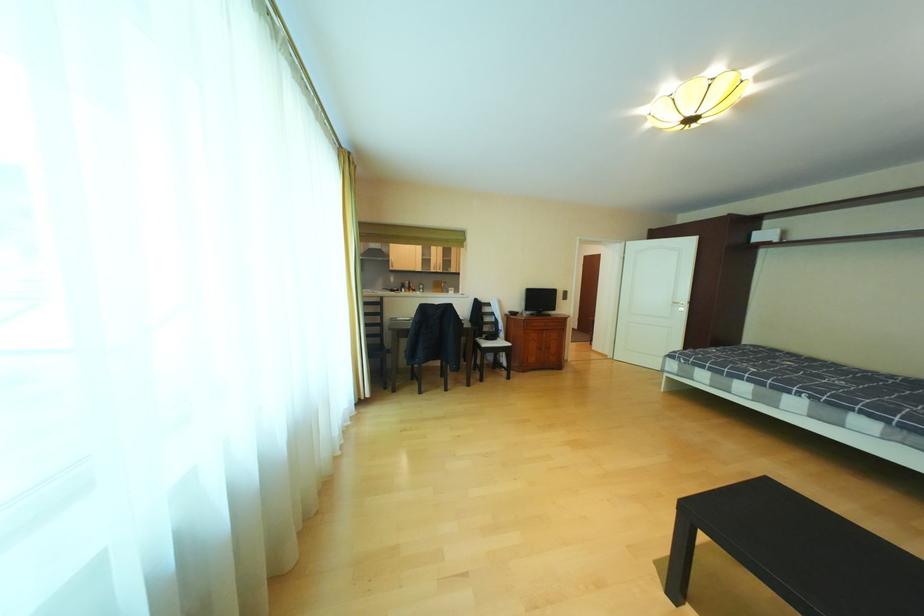
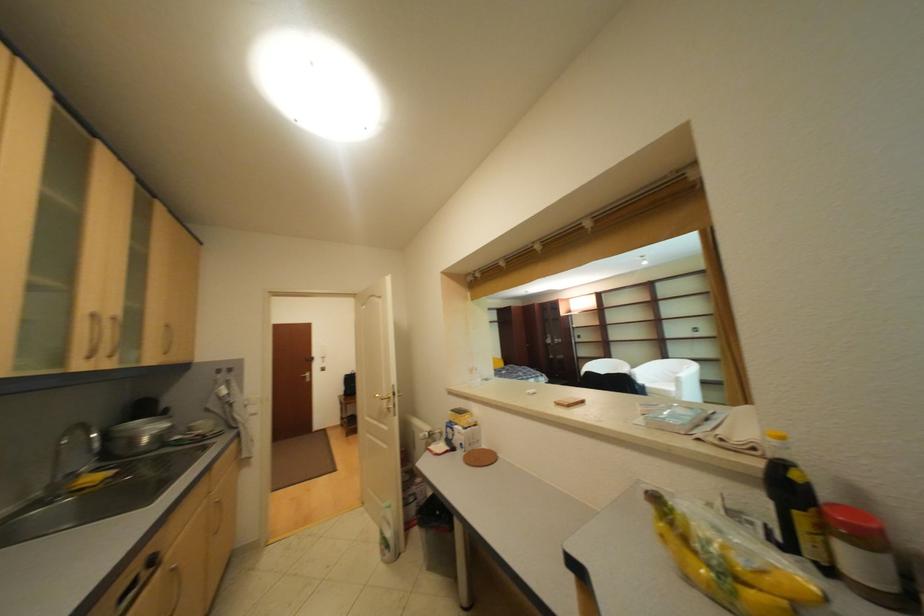
Question: I am providing you with two images of the same scene from different viewpoints. Please identify which objects are invisible in image2.

Choices:
 (A) lower cabinet handle
 (B) brown door handle
 (C) faucet handle
 (D) none of these

Answer: (D)